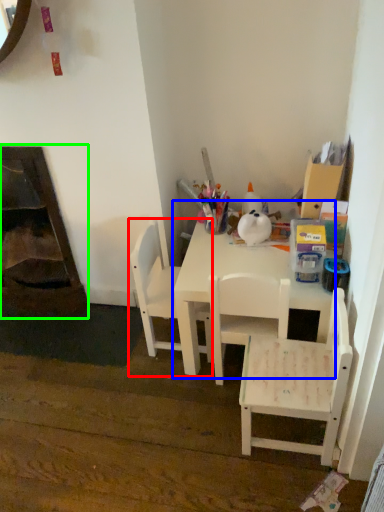
Question: Based on their relative distances, which object is nearer to chair (highlighted by a red box)? Choose from table (highlighted by a blue box) and fireplace (highlighted by a green box).

Choices:
 (A) table
 (B) fireplace

Answer: (A)